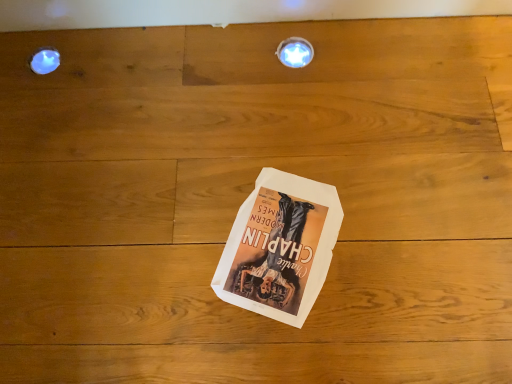
This screenshot has width=512, height=384. In order to click on vacant space underneath white paper at center (from a real-world perspective) in this screenshot , I will do pyautogui.click(x=279, y=241).